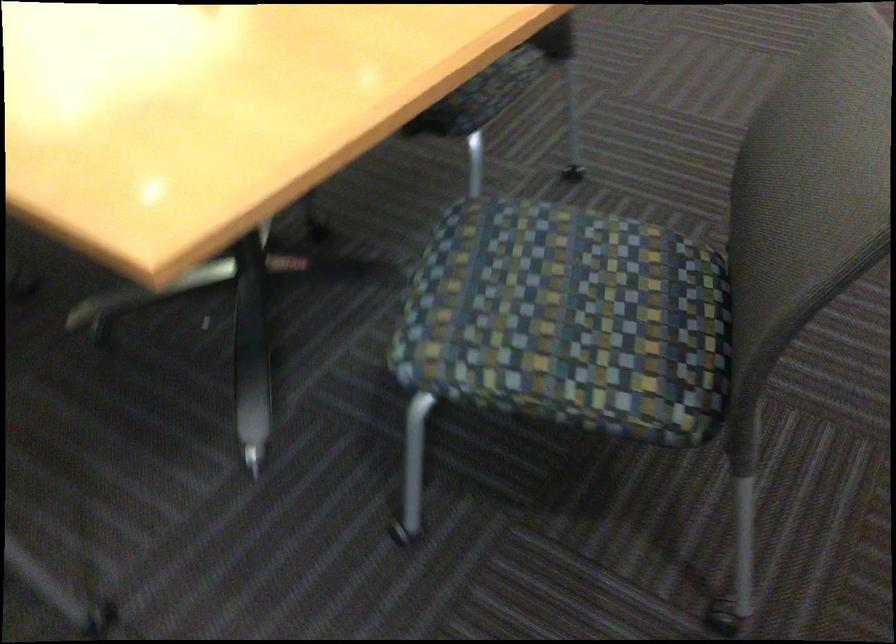
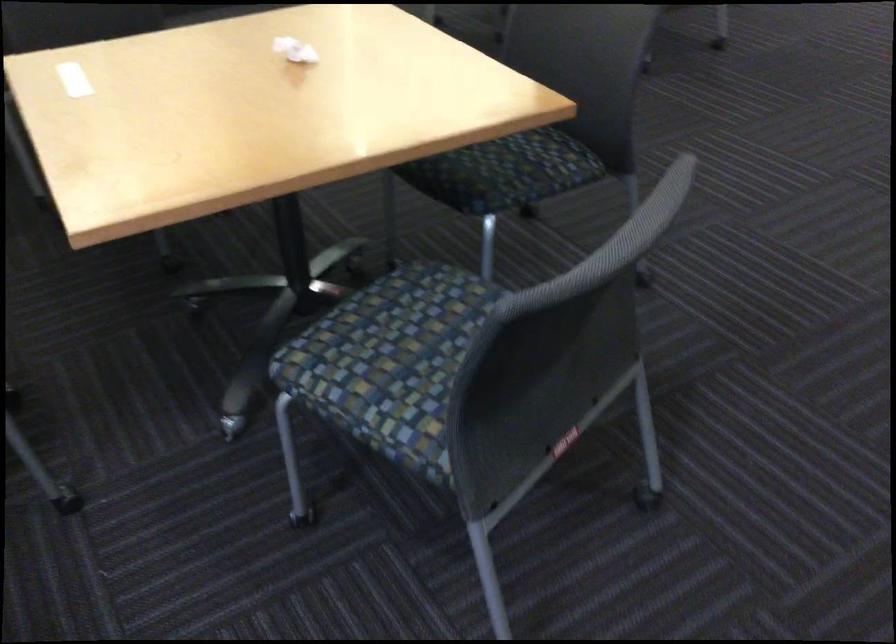
Where in the second image is the point corresponding to (486,80) from the first image?

(504, 172)